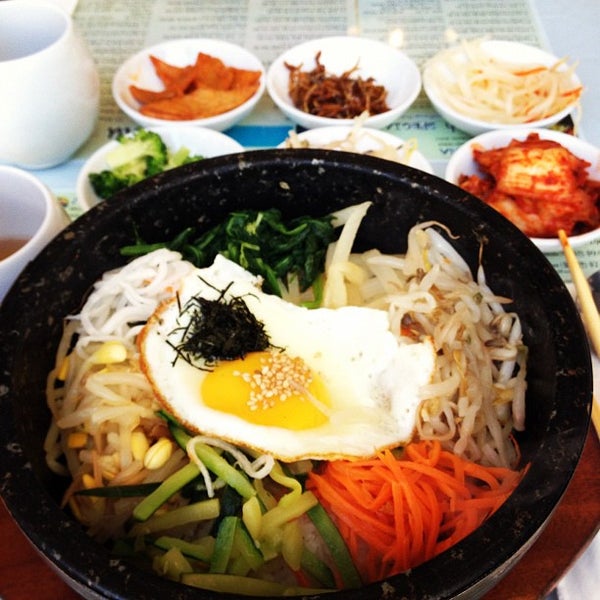
Locate an element on the screen. This screenshot has height=600, width=600. teacup is located at coordinates (31, 231), (29, 44).